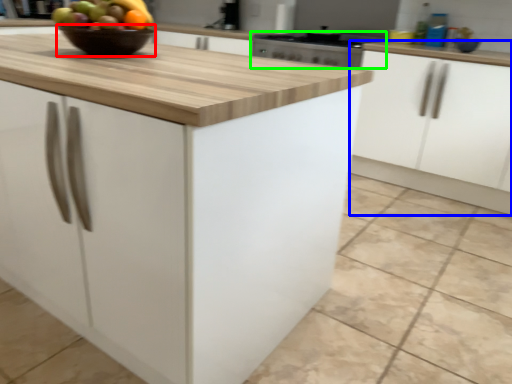
Question: Estimate the real-world distances between objects in this image. Which object is closer to glass bowl (highlighted by a red box), cabinetry (highlighted by a blue box) or kitchen appliance (highlighted by a green box)?

Choices:
 (A) cabinetry
 (B) kitchen appliance

Answer: (B)